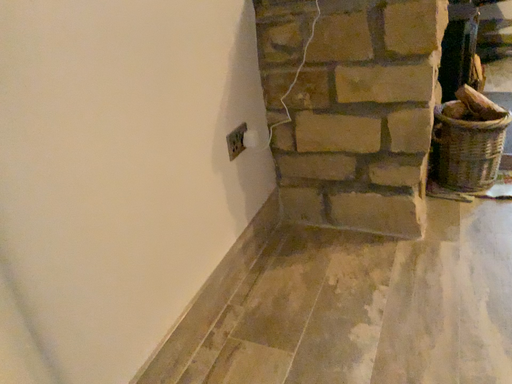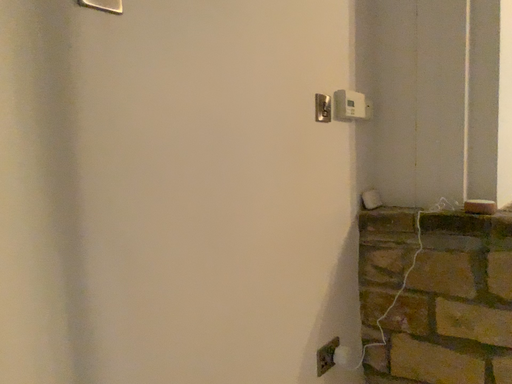
Question: Which way did the camera rotate in the video?

Choices:
 (A) rotated right
 (B) rotated left

Answer: (B)